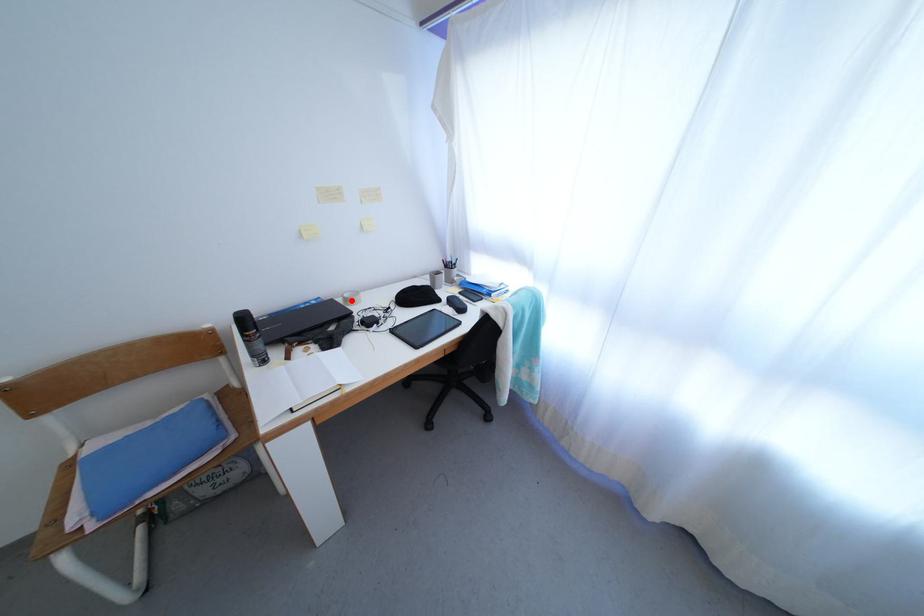
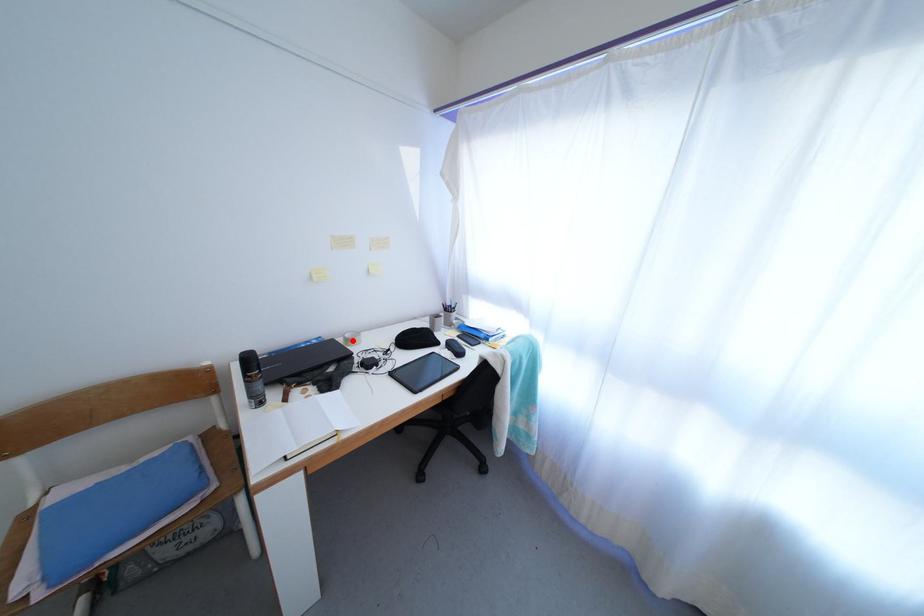
I am providing you with two images of the same scene from different viewpoints. A red point is marked on the first image and another point is marked on the second image. Do the highlighted points in image1 and image2 indicate the same real-world spot?

Yes